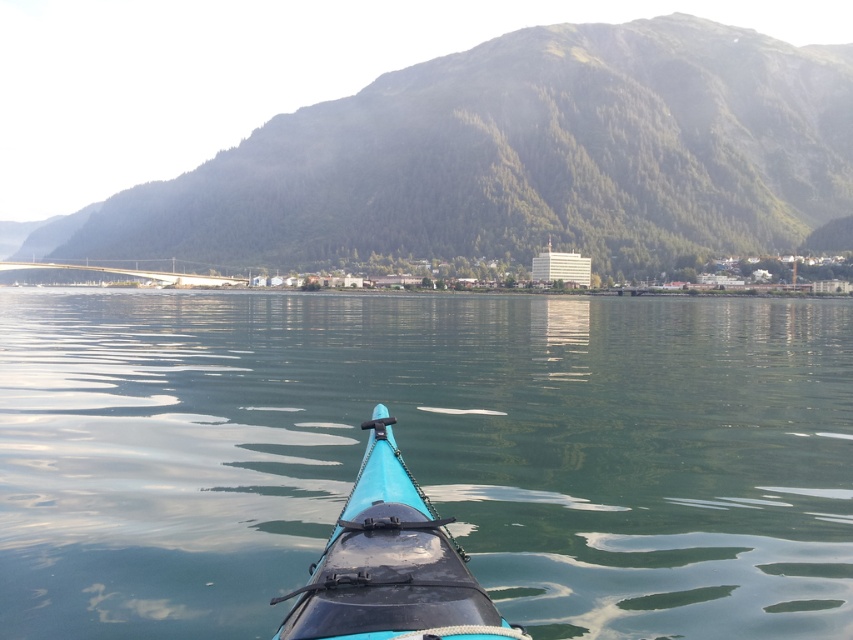
Can you confirm if green smooth water at center is positioned to the right of green forested mountain at upper center?

Yes, green smooth water at center is to the right of green forested mountain at upper center.

Between green smooth water at center and green forested mountain at upper center, which one is positioned higher?

Positioned higher is green forested mountain at upper center.

Is point (347, 464) positioned in front of point (611, 77)?

That is True.

This screenshot has height=640, width=853. What are the coordinates of `green smooth water at center` in the screenshot? It's located at (426, 456).

Is green smooth water at center further to the viewer compared to teal matte kayak at center?

Yes, it is behind teal matte kayak at center.

Is green smooth water at center taller than teal matte kayak at center?

Yes.

Image resolution: width=853 pixels, height=640 pixels. Identify the location of green smooth water at center. coord(426,456).

At what (x,y) coordinates should I click in order to perform the action: click on green smooth water at center. Please return your answer as a coordinate pair (x, y). The width and height of the screenshot is (853, 640). Looking at the image, I should click on (426, 456).

Does point (425, 196) come closer to viewer compared to point (442, 605)?

No, it is not.

Consider the image. Which is below, green forested mountain at upper center or teal matte kayak at center?

Positioned lower is teal matte kayak at center.

Between point (583, 70) and point (357, 524), which one is positioned in front?

Positioned in front is point (357, 524).

Identify the location of green forested mountain at upper center. The width and height of the screenshot is (853, 640). (520, 156).